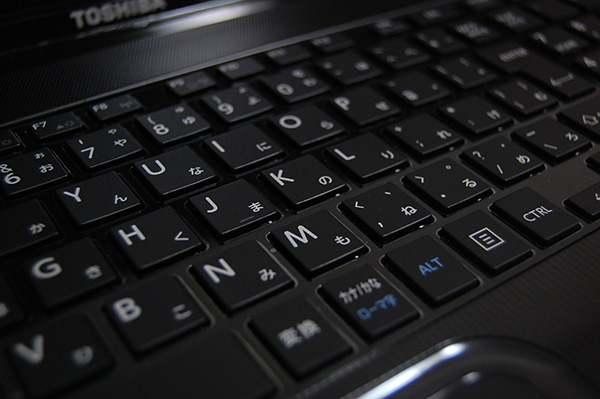
The width and height of the screenshot is (600, 399). What are the coordinates of `speakers above keyboard and below laptop screen` in the screenshot? It's located at (32, 91), (144, 57), (257, 25).